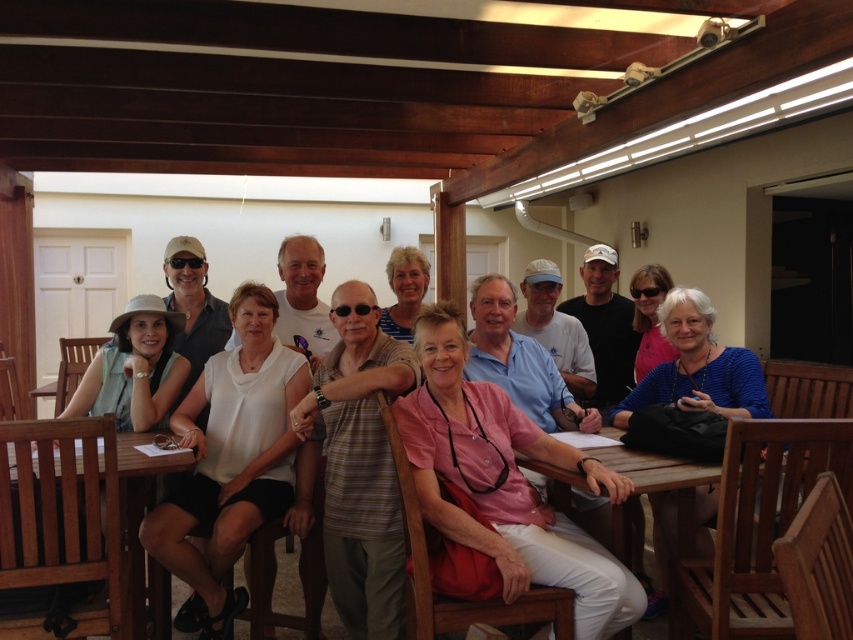
Question: Does teak wood table at lower left lie in front of wooden table at center?

Choices:
 (A) no
 (B) yes

Answer: (B)

Question: Which point appears closest to the camera in this image?

Choices:
 (A) (97, 460)
 (B) (730, 436)

Answer: (B)

Question: Can you confirm if teak wood table at lower left is positioned to the left of wooden table at center?

Choices:
 (A) yes
 (B) no

Answer: (A)

Question: Which point appears closest to the camera in this image?

Choices:
 (A) (692, 472)
 (B) (64, 545)

Answer: (B)

Question: Observing the image, what is the correct spatial positioning of teak wood table at lower left in reference to wooden table at center?

Choices:
 (A) left
 (B) right

Answer: (A)